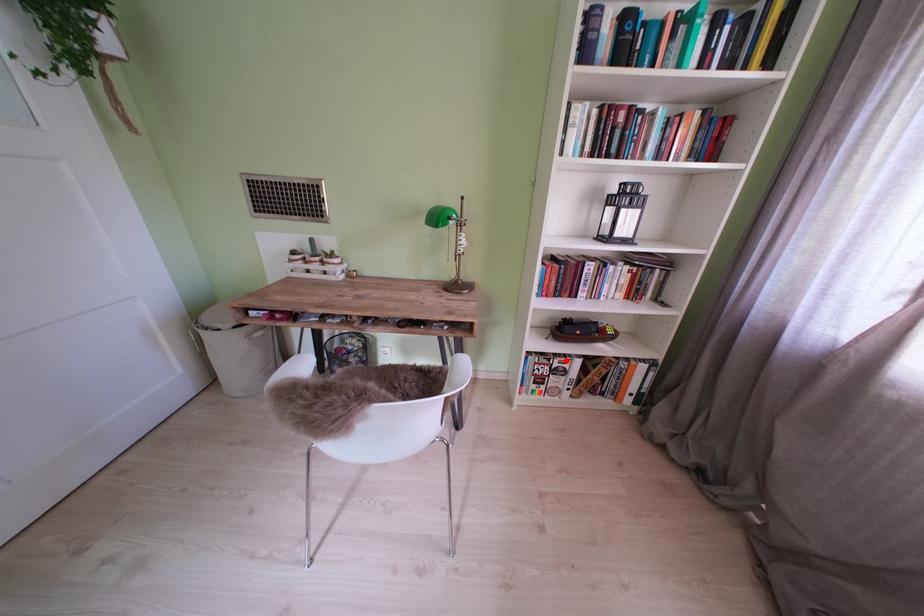
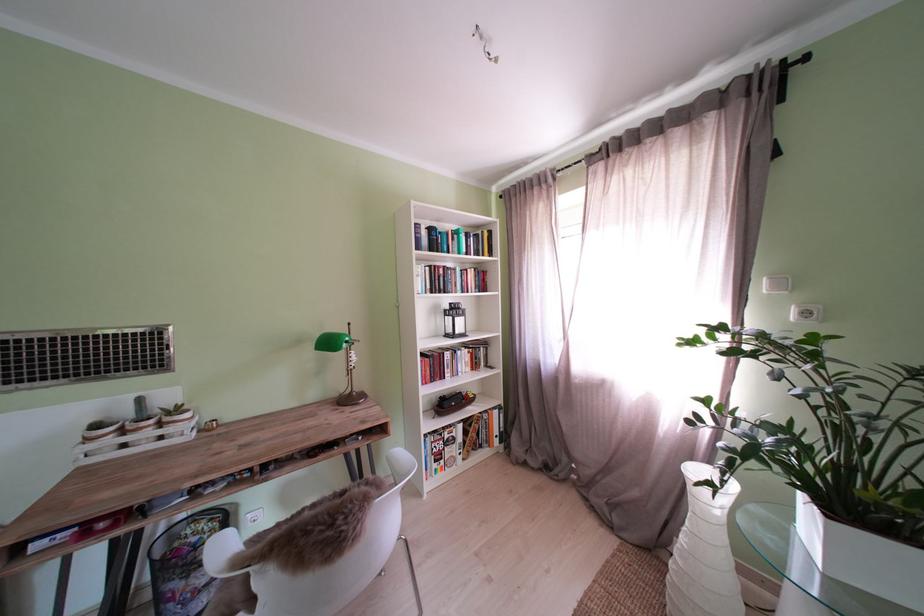
The point at the highlighted location is marked in the first image. Where is the corresponding point in the second image?

(456, 434)